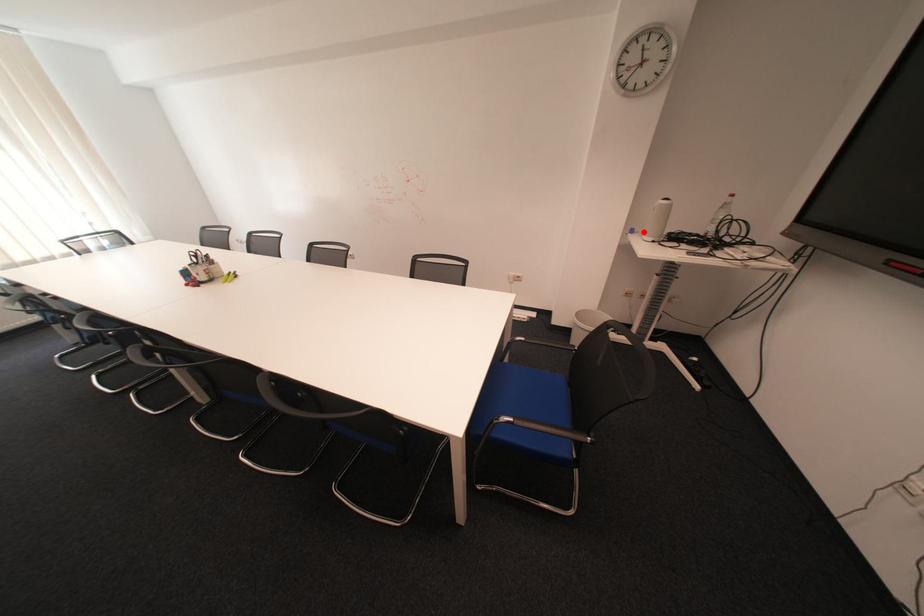
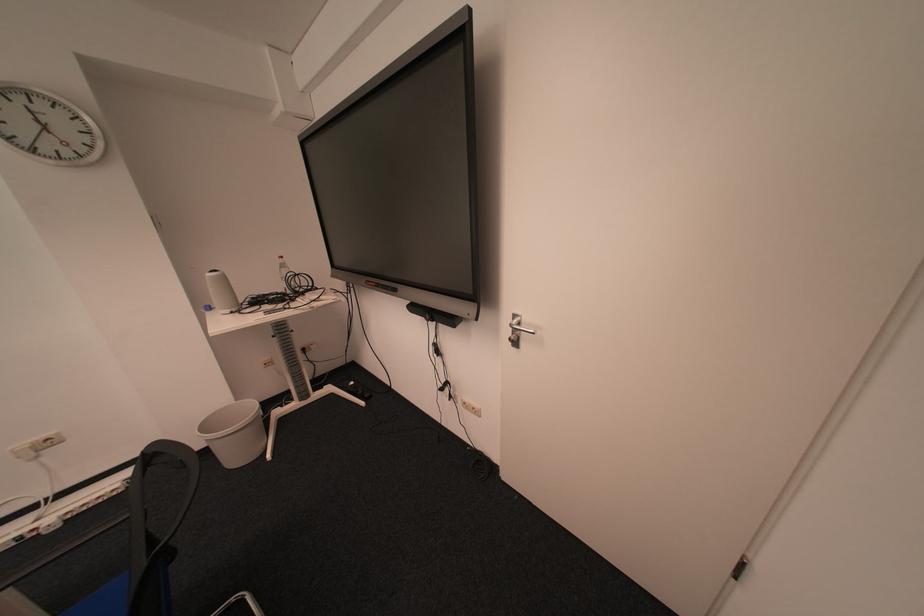
Locate, in the second image, the point that corresponds to the highlighted location in the first image.

(221, 309)